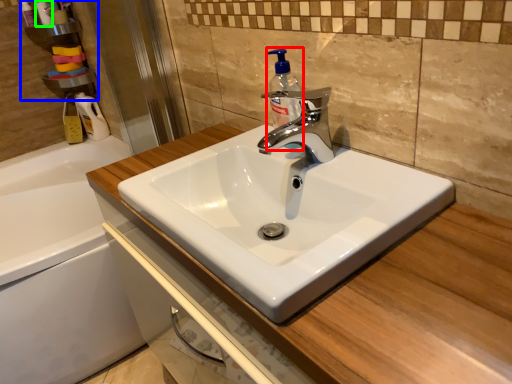
Question: Based on their relative distances, which object is nearer to soap dispenser (highlighted by a red box)? Choose from shelf (highlighted by a blue box) and toiletry (highlighted by a green box).

Choices:
 (A) shelf
 (B) toiletry

Answer: (A)